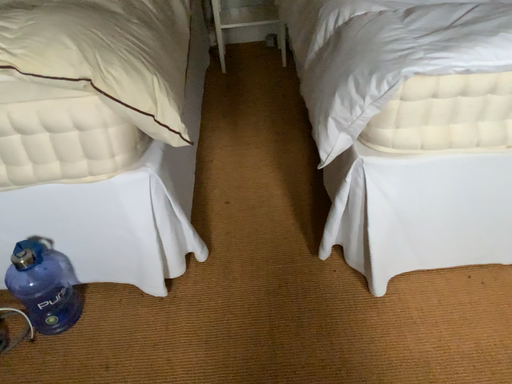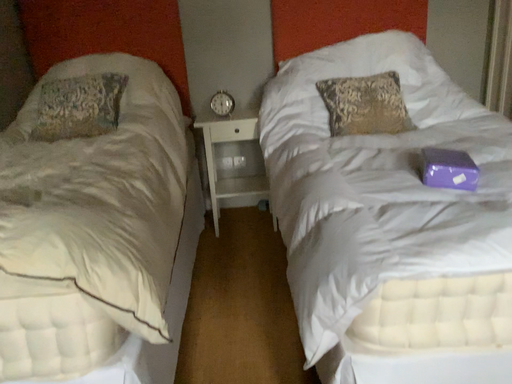
Question: Which way did the camera rotate in the video?

Choices:
 (A) rotated upward
 (B) rotated downward

Answer: (A)